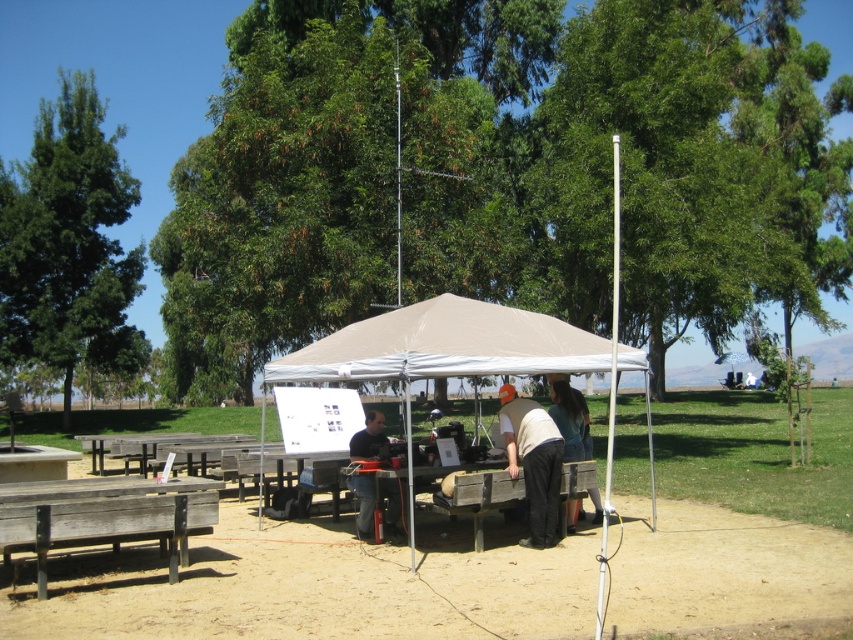
Does point (171, 573) come behind point (361, 451)?

No, it is not.

Is wooden bench at lower left bigger than dark gray shirt at center?

Indeed, wooden bench at lower left has a larger size compared to dark gray shirt at center.

Between point (206, 516) and point (361, 449), which one is positioned behind?

The point (361, 449) is more distant.

Locate an element on the screen. Image resolution: width=853 pixels, height=640 pixels. wooden bench at lower left is located at coordinates (103, 516).

Where is `green leafy tree at left`? This screenshot has width=853, height=640. green leafy tree at left is located at coordinates (68, 243).

From the picture: Is green leafy tree at left behind dark gray shirt at center?

Yes, it is behind dark gray shirt at center.

Describe the element at coordinates (68, 243) in the screenshot. This screenshot has height=640, width=853. I see `green leafy tree at left` at that location.

Locate an element on the screen. green leafy tree at left is located at coordinates (68, 243).

Which of these two, green leafy tree at upper center or dark green fabric jacket at center, stands taller?

With more height is green leafy tree at upper center.

Is green leafy tree at upper center bigger than dark green fabric jacket at center?

Yes.

Does point (279, 204) come closer to viewer compared to point (567, 406)?

No, it is behind (567, 406).

This screenshot has width=853, height=640. Identify the location of green leafy tree at upper center. (502, 173).